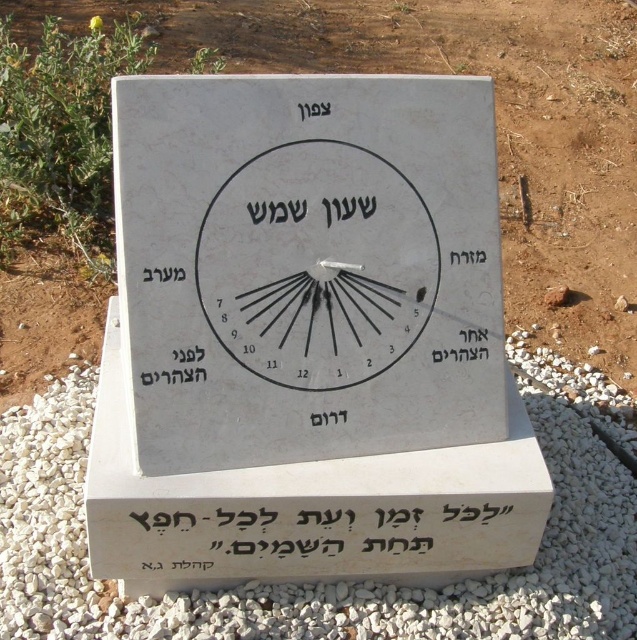
You are a gardener who wants to place a new decorative statue that is 1.2 meters tall. You have two options for placement in the garden scene shown. The first option is near the white stone sundial at center, and the second is near the white gravel at lower center. Which location would allow the statue to be more visible from above? Please explain your reasoning.

The white stone sundial at center is taller than the white gravel at lower center. Placing the statue near the white stone sundial at center would elevate it, making it more visible from above compared to placing it near the lower white gravel at lower center.

You are standing in a garden and see a stone sundial mounted on a rectangular base. There is a point at coordinates (496, 122). What is the color of the surface at that point?

The point at coordinates (496, 122) is on brown soil at center.